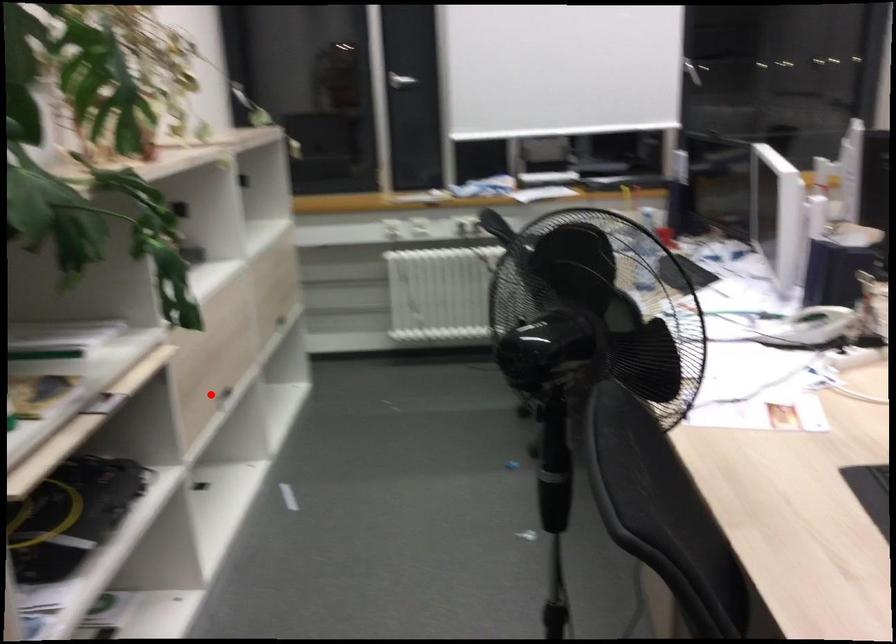
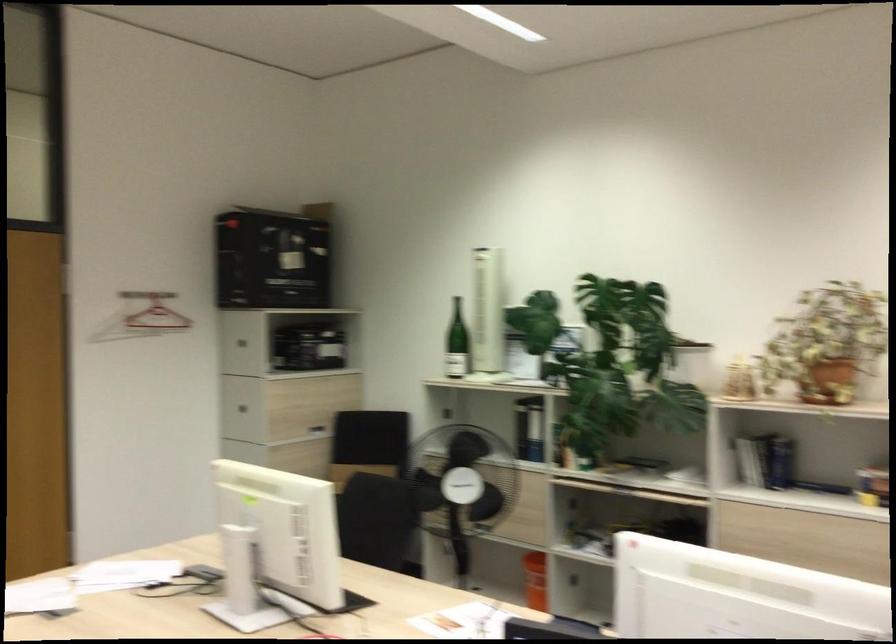
Question: I am providing you with two images of the same scene from different viewpoints. A red point is marked on the first image. Can you still see the location of the red point in image 2?

Choices:
 (A) Yes
 (B) No

Answer: (B)